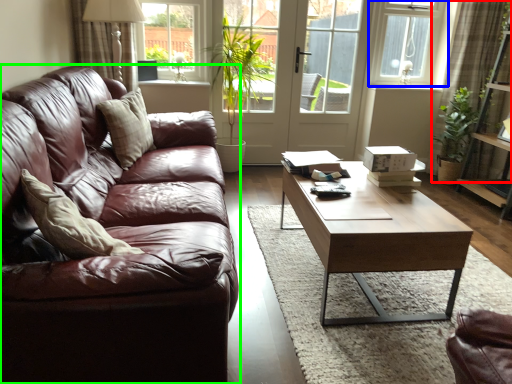
Question: Which object is positioned farthest from curtain (highlighted by a red box)? Select from window (highlighted by a blue box) and studio couch (highlighted by a green box).

Choices:
 (A) window
 (B) studio couch

Answer: (B)